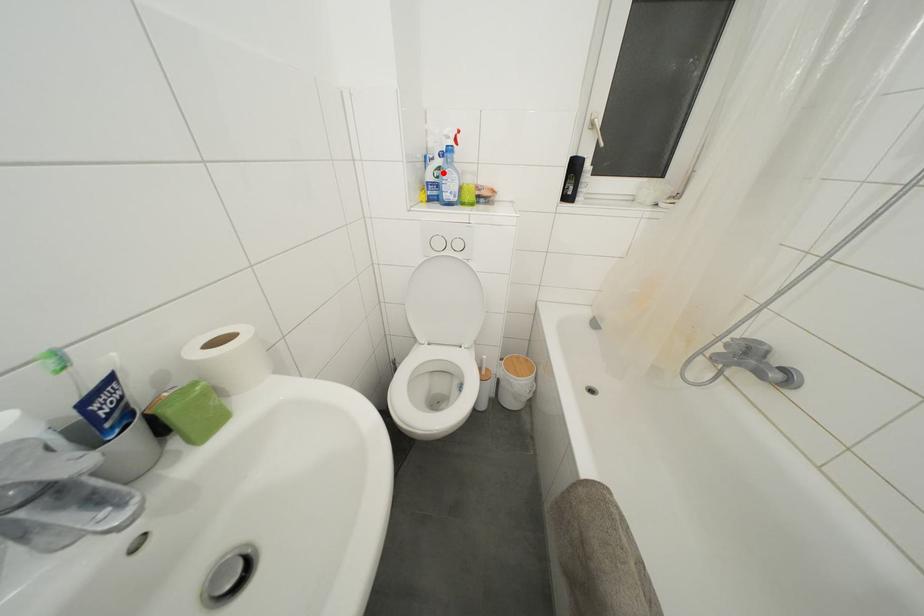
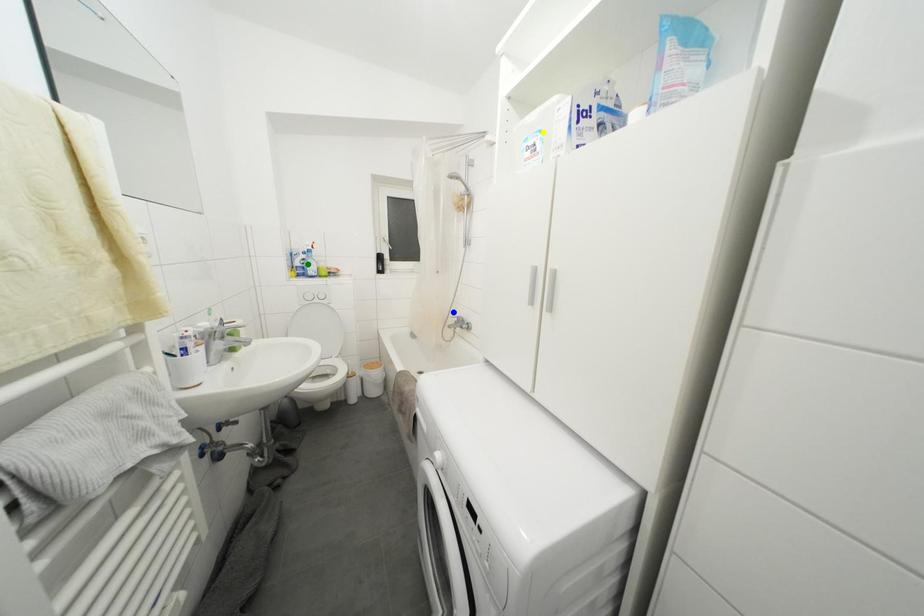
Question: I am providing you with two images of the same scene from different viewpoints. A red point is marked on the first image. You are given multiple points on the second image. Which point in image 2 represents the same 3d spot as the red point in image 1?

Choices:
 (A) yellow point
 (B) green point
 (C) blue point

Answer: (B)